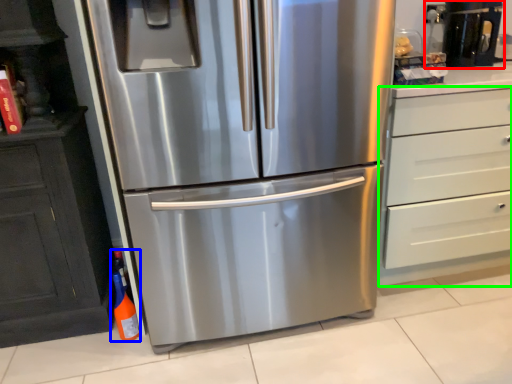
Question: Which object is positioned closest to coffee machine (highlighted by a red box)? Select from bottle (highlighted by a blue box) and chest of drawers (highlighted by a green box).

Choices:
 (A) bottle
 (B) chest of drawers

Answer: (B)